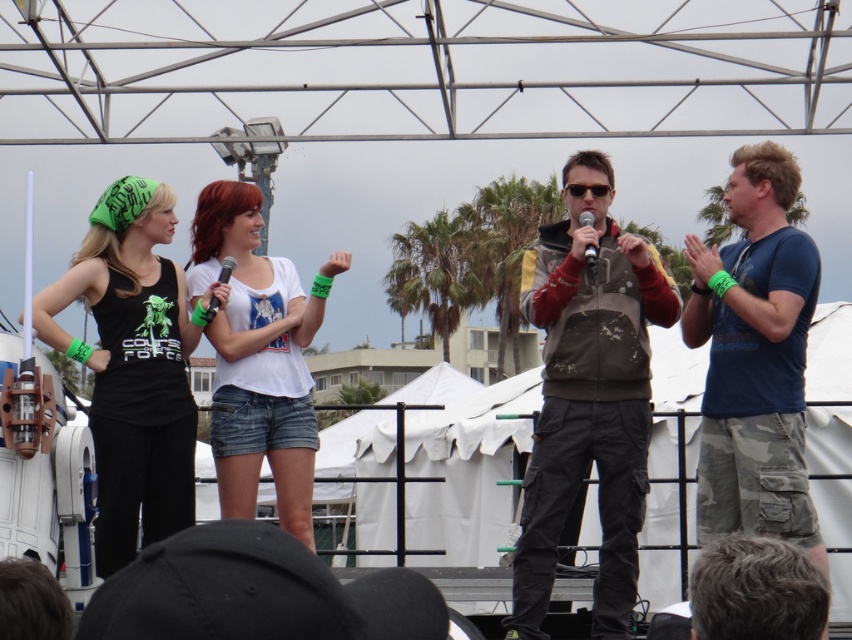
Question: Which object is positioned farthest from the distressed brown jacket at center?

Choices:
 (A) white cotton shirt at center
 (B) silver metallic microphone at center
 (C) matte black tank top at left
 (D) black plastic microphone at center

Answer: (D)

Question: Is matte black tank top at left wider than silver metallic microphone at center?

Choices:
 (A) yes
 (B) no

Answer: (A)

Question: Which object appears closest to the camera in this image?

Choices:
 (A) distressed brown jacket at center
 (B) blue cotton shirt at center
 (C) white cotton shirt at center
 (D) matte black tank top at left

Answer: (B)

Question: Is black plastic microphone at center above silver metallic microphone at center?

Choices:
 (A) no
 (B) yes

Answer: (A)

Question: Does distressed brown jacket at center lie behind matte black tank top at left?

Choices:
 (A) yes
 (B) no

Answer: (B)

Question: Estimate the real-world distances between objects in this image. Which object is farther from the black plastic microphone at center?

Choices:
 (A) matte black tank top at left
 (B) distressed brown jacket at center
 (C) silver metallic microphone at center
 (D) white cotton shirt at center

Answer: (B)